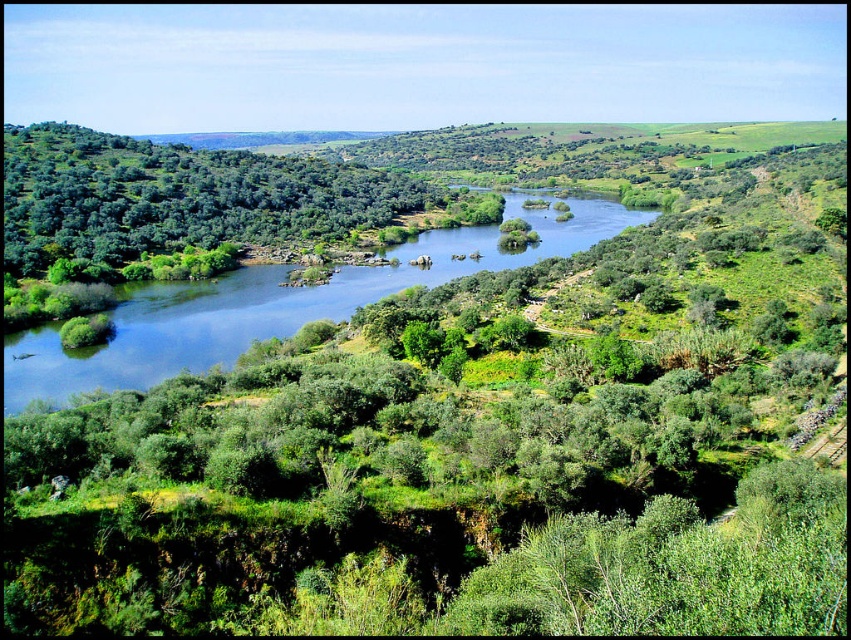
Describe the element at coordinates (178, 196) in the screenshot. Image resolution: width=851 pixels, height=640 pixels. I see `green leafy trees at left` at that location.

Is green leafy trees at left positioned at the back of blue water at center?

Yes.

Locate an element on the screen. The height and width of the screenshot is (640, 851). green leafy trees at left is located at coordinates (178, 196).

Find the location of `green leafy trees at left`. green leafy trees at left is located at coordinates (178, 196).